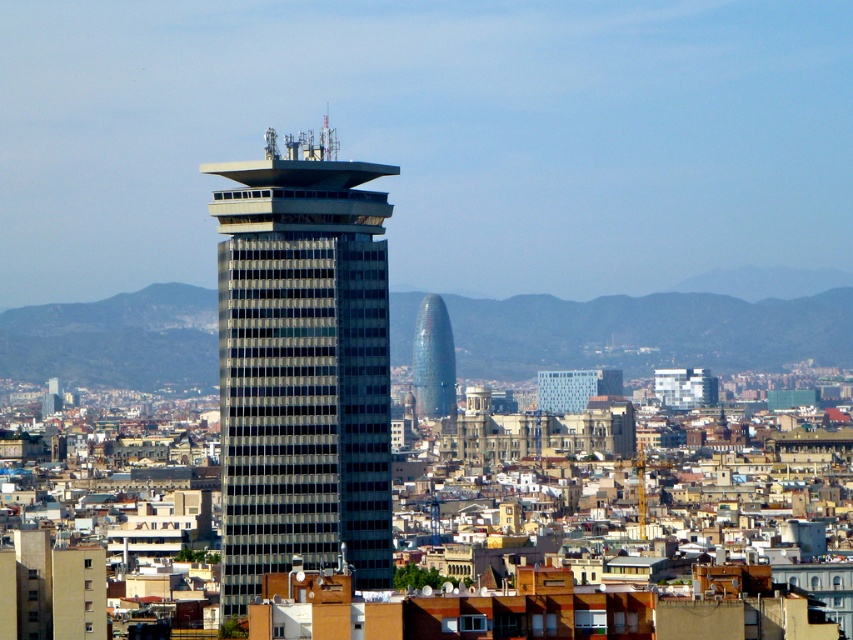
You are an architect evaluating the cityscape. You notice the matte glass skyscraper at center and the blue glass tower at center. Which one is taller?

The matte glass skyscraper at center is taller than the blue glass tower at center according to the description.

You are an architect analyzing the cityscape. You notice the matte glass skyscraper at center and the blue glass tower at center. Based on their positions, which one do you think has a larger footprint in terms of base area?

The matte glass skyscraper at center might be wider than blue glass tower at center, so it likely has a larger footprint.

You are a photographer standing in front of the tall modern building. You want to take a photo that includes both point (x=308, y=154) and point (x=421, y=388). Which point will appear closer to the edge of the photo frame?

Point (x=421, y=388) will appear closer to the edge of the photo frame because it is further away from the camera compared to point (x=308, y=154).